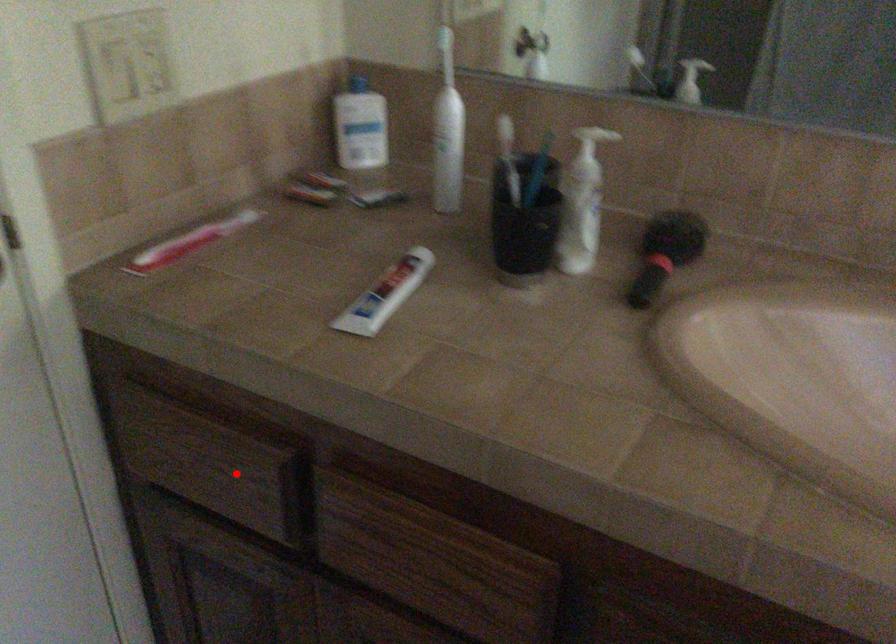
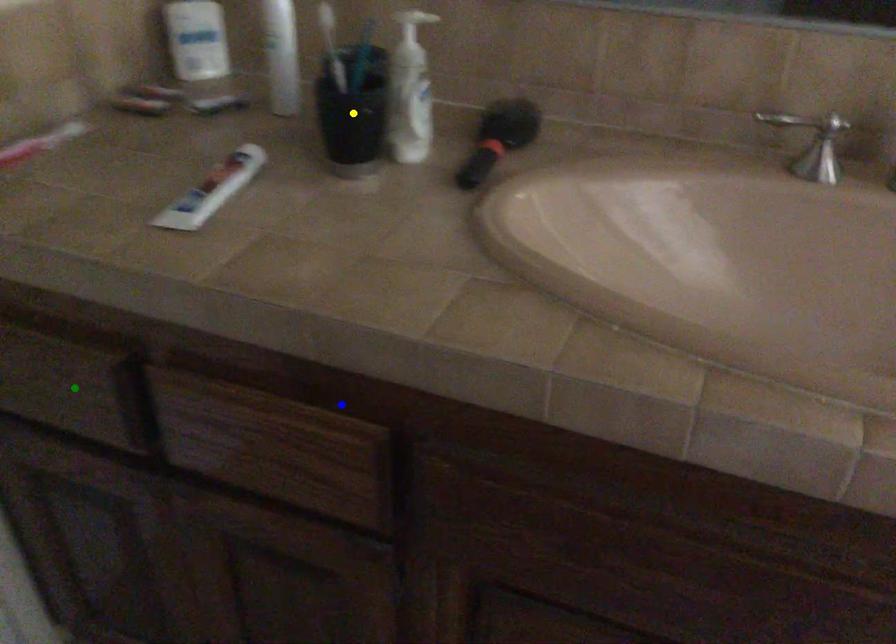
Question: I am providing you with two images of the same scene from different viewpoints. A red point is marked on the first image. You are given multiple points on the second image. Which point in image 2 is actually the same real-world point as the red point in image 1?

Choices:
 (A) yellow point
 (B) green point
 (C) blue point

Answer: (B)